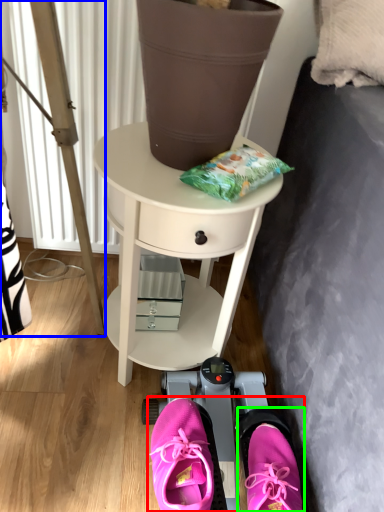
Question: Based on their relative distances, which object is nearer to couple (highlighted by a red box)? Choose from ladder (highlighted by a blue box) and footwear (highlighted by a green box).

Choices:
 (A) ladder
 (B) footwear

Answer: (B)